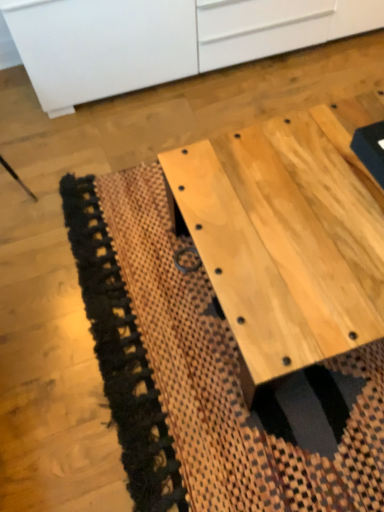
I want to click on free spot to the left of natural wood table at center, so click(x=126, y=286).